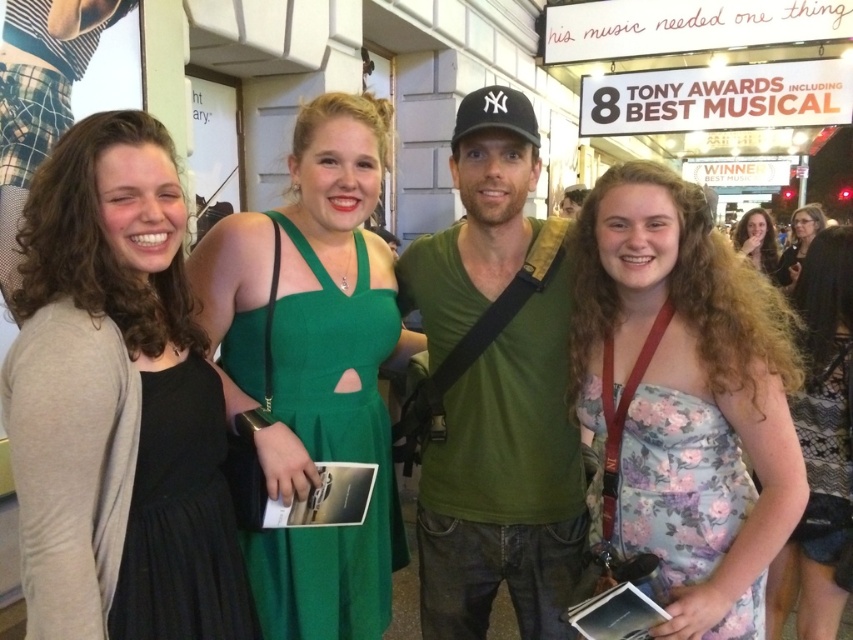
Does green cotton shirt at center appear on the right side of black satin dress at left?

Yes, green cotton shirt at center is to the right of black satin dress at left.

Can you confirm if green cotton shirt at center is wider than black satin dress at left?

Correct, the width of green cotton shirt at center exceeds that of black satin dress at left.

The height and width of the screenshot is (640, 853). Find the location of `green cotton shirt at center`. green cotton shirt at center is located at coordinates coord(494,390).

Is matte black dress at left shorter than floral chiffon dress at center?

No.

Between point (129, 621) and point (595, 516), which one is positioned in front?

Positioned in front is point (129, 621).

Which is in front, point (125, 218) or point (698, 445)?

Point (125, 218) is in front.

At what (x,y) coordinates should I click in order to perform the action: click on matte black dress at left. Please return your answer as a coordinate pair (x, y). This screenshot has height=640, width=853. Looking at the image, I should click on (144, 369).

Can you confirm if matte black dress at left is bigger than floral fabric dress at center?

Actually, matte black dress at left might be smaller than floral fabric dress at center.

Is point (86, 224) farther from viewer compared to point (804, 624)?

No, (86, 224) is in front of (804, 624).

Who is more distant from viewer, (86,202) or (817,257)?

Point (817,257)

The width and height of the screenshot is (853, 640). Identify the location of matte black dress at left. (144, 369).